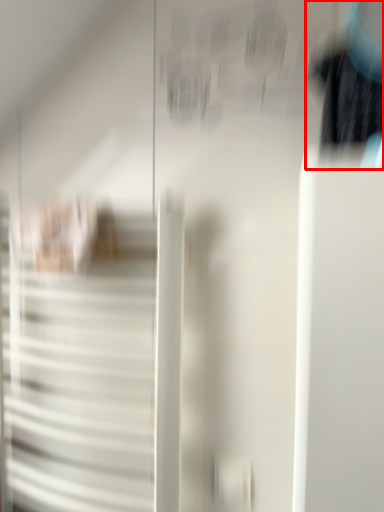
Question: From the image's perspective, considering the relative positions of couple (annotated by the red box) and door in the image provided, where is couple (annotated by the red box) located with respect to the staircase?

Choices:
 (A) above
 (B) below

Answer: (A)